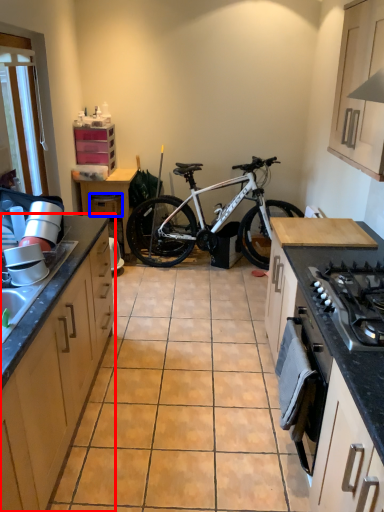
Question: Which point is further to the camera, cabinetry (highlighted by a red box) or drawer (highlighted by a blue box)?

Choices:
 (A) cabinetry
 (B) drawer

Answer: (B)